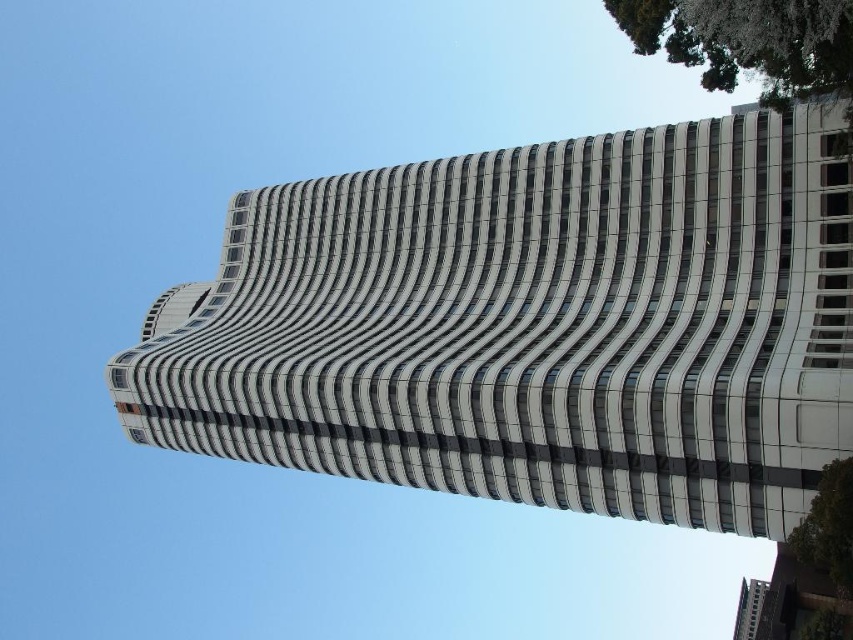
You are standing in a park and looking at the white smooth building at center and the green leafy tree at lower right. Which object is closer to you?

The green leafy tree at lower right is closer to you because the white smooth building at center is further away.

You are an architect analyzing the building and tree in the image. Based on their sizes, which one would require more materials to construct the white smooth building at center and the green leafy tree at upper right?

The white smooth building at center is bigger than the green leafy tree at upper right, so it would require more materials to construct the white smooth building at center.